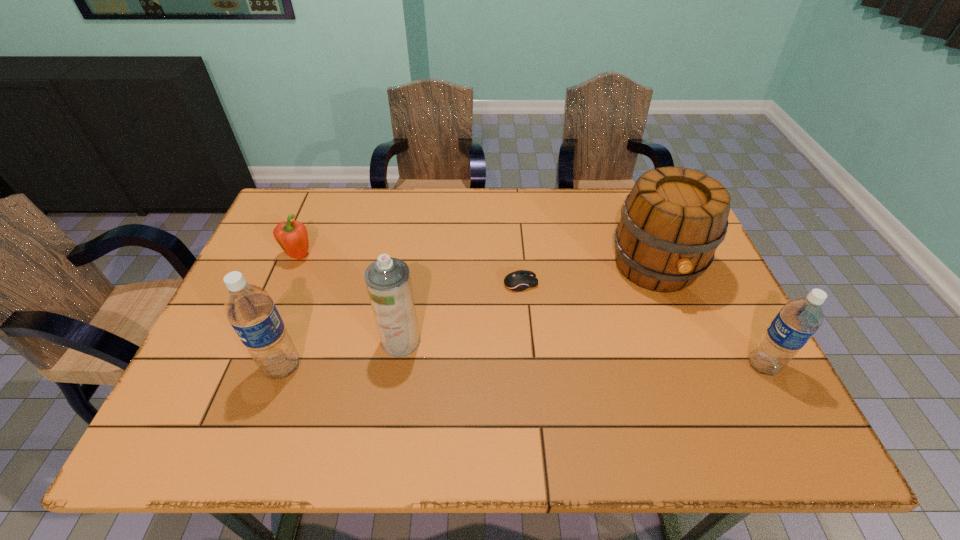
You are a GUI agent. You are given a task and a screenshot of the screen. Output one action in this format:
    pyautogui.click(x=<x>, y=<y>)
    Task: Click on the object that is at the near right corner
    The image size is (960, 540).
    Given the screenshot: What is the action you would take?
    pyautogui.click(x=799, y=319)

Where is `free space at the far edge of the desktop`? free space at the far edge of the desktop is located at coordinates (518, 202).

In order to click on free space at the near edge of the desktop in this screenshot , I will do `click(533, 374)`.

In the image, there is a desktop. Where is `free space at the left edge`? This screenshot has height=540, width=960. free space at the left edge is located at coordinates (276, 255).

The image size is (960, 540). I want to click on free point at the right edge, so click(x=748, y=351).

Find the location of a particular element. The width and height of the screenshot is (960, 540). free space at the far left corner of the desktop is located at coordinates (296, 217).

Image resolution: width=960 pixels, height=540 pixels. In order to click on vacant space at the near left corner of the desktop in this screenshot , I will do `click(244, 387)`.

Locate an element on the screen. The width and height of the screenshot is (960, 540). vacant space at the near right corner is located at coordinates (753, 376).

Locate an element on the screen. Image resolution: width=960 pixels, height=540 pixels. free space that is in between the pepper and the aerosol can is located at coordinates (349, 299).

Find the location of a particular element. The height and width of the screenshot is (540, 960). free space between the fifth tallest object and the cider is located at coordinates (477, 261).